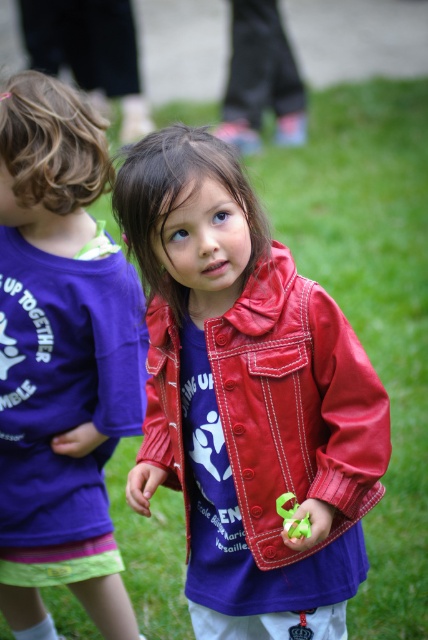
You are a photographer trying to capture both the shiny red jacket at center and the purple cotton shirt at left in a single shot. The camera you are using has a maximum focus range of 25 inches. Can both subjects be in focus?

The distance between the shiny red jacket at center and the purple cotton shirt at left is 28.07 inches, which exceeds the camera maximum focus range of 25 inches. Therefore, both subjects cannot be in focus at the same time.

You are a photographer trying to capture a photo of the green rubber toy at center. However, the purple cotton shirt at left is blocking your view. Can you move the shirt to the side to get a clear shot?

The purple cotton shirt at left is located above the green rubber toy at center, so moving the shirt downward would allow you to see the green rubber toy at center clearly.